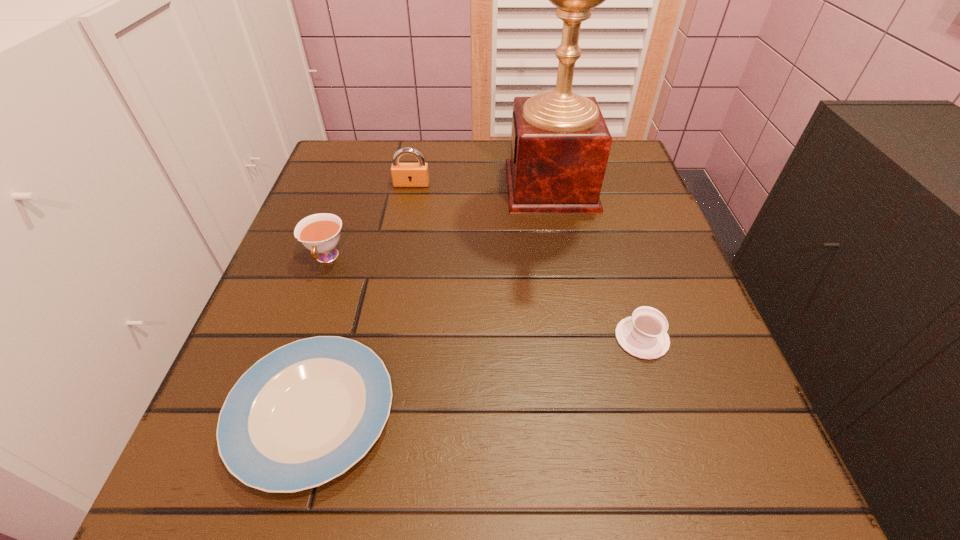
The height and width of the screenshot is (540, 960). What are the coordinates of `the closest object to the taller teacup` in the screenshot? It's located at (304, 414).

This screenshot has width=960, height=540. Identify the location of object that ranks as the fourth closest to the second tallest object. (644, 335).

The height and width of the screenshot is (540, 960). Find the location of `free location that satisfies the following two spatial constraints: 1. on the plaque of the trophy cup; 2. on the handle side of the shorter teacup`. free location that satisfies the following two spatial constraints: 1. on the plaque of the trophy cup; 2. on the handle side of the shorter teacup is located at coordinates (580, 338).

This screenshot has height=540, width=960. In order to click on free spot that satisfies the following two spatial constraints: 1. on the handle side of the right teacup; 2. on the plaque of the trophy cup in this screenshot , I will do `click(594, 186)`.

At what (x,y) coordinates should I click in order to perform the action: click on free space in the image that satisfies the following two spatial constraints: 1. on the handle side of the right teacup; 2. on the plaque of the trophy cup. Please return your answer as a coordinate pair (x, y). Image resolution: width=960 pixels, height=540 pixels. Looking at the image, I should click on pos(594,186).